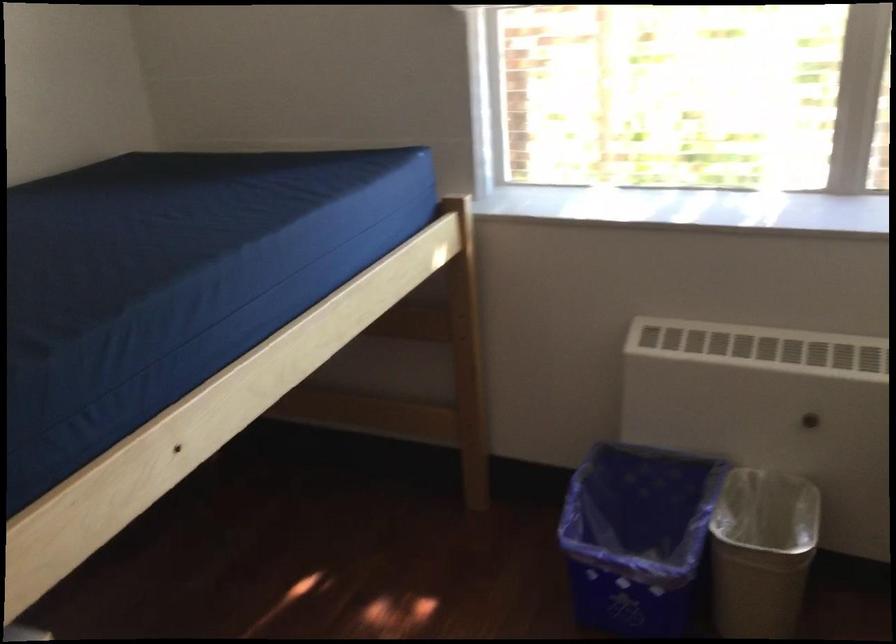
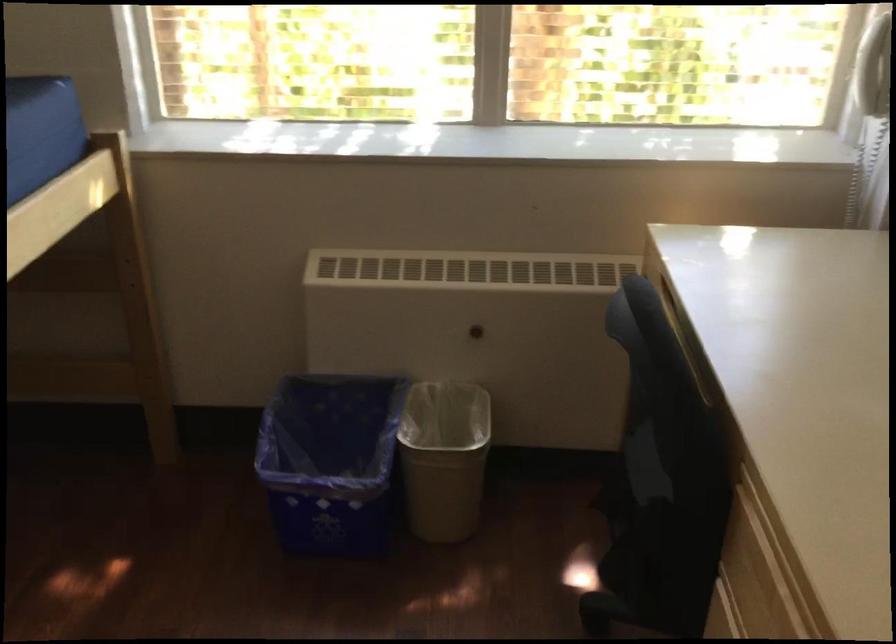
Locate, in the second image, the point that corresponds to (631,535) in the first image.

(330, 462)